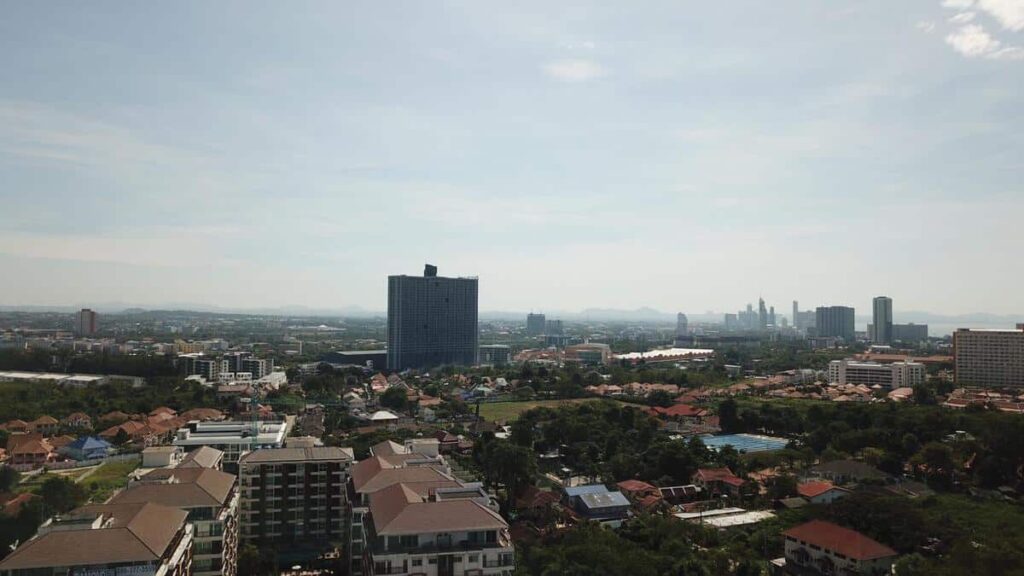
Where is `windows of house in bottom center of image`? The width and height of the screenshot is (1024, 576). windows of house in bottom center of image is located at coordinates (413, 562), (428, 560), (455, 558), (471, 558).